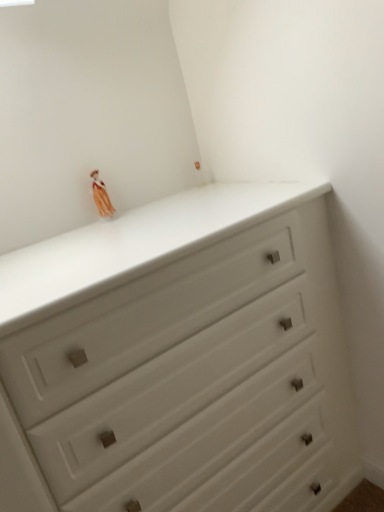
Question: From the image's perspective, is matte orange fabric doll at upper left located above or below white matte chest of drawers at upper center?

Choices:
 (A) above
 (B) below

Answer: (A)

Question: Considering the positions of matte orange fabric doll at upper left and white matte chest of drawers at upper center in the image, is matte orange fabric doll at upper left bigger or smaller than white matte chest of drawers at upper center?

Choices:
 (A) big
 (B) small

Answer: (B)

Question: In the image, is matte orange fabric doll at upper left positioned in front of or behind white matte chest of drawers at upper center?

Choices:
 (A) behind
 (B) front

Answer: (A)

Question: Considering the positions of white matte chest of drawers at upper center and matte orange fabric doll at upper left in the image, is white matte chest of drawers at upper center taller or shorter than matte orange fabric doll at upper left?

Choices:
 (A) tall
 (B) short

Answer: (A)

Question: In the image, is white matte chest of drawers at upper center positioned in front of or behind matte orange fabric doll at upper left?

Choices:
 (A) front
 (B) behind

Answer: (A)

Question: From the image's perspective, is white matte chest of drawers at upper center positioned above or below matte orange fabric doll at upper left?

Choices:
 (A) above
 (B) below

Answer: (B)

Question: Looking at the image, does white matte chest of drawers at upper center seem bigger or smaller compared to matte orange fabric doll at upper left?

Choices:
 (A) big
 (B) small

Answer: (A)